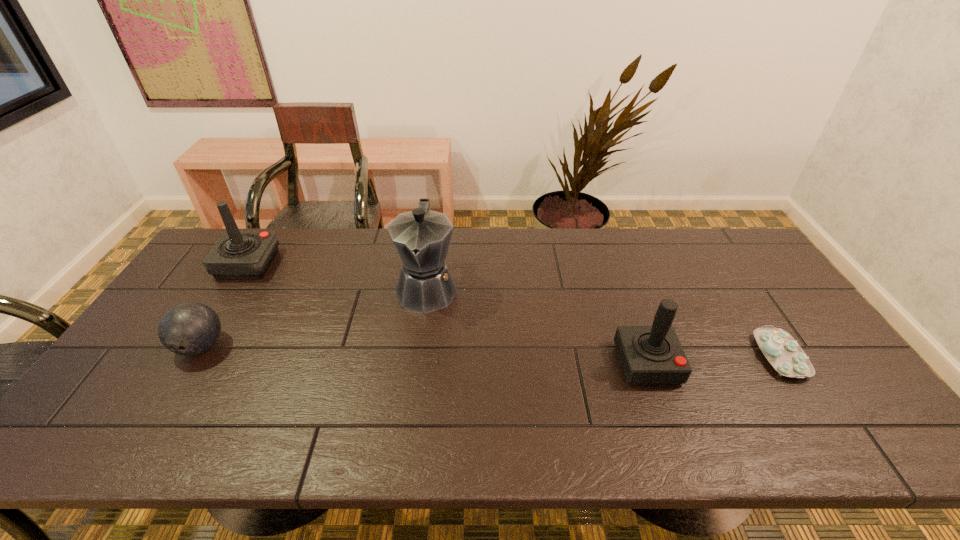
Identify the location of vacant space at the near edge of the desktop. The height and width of the screenshot is (540, 960). (762, 449).

The image size is (960, 540). What are the coordinates of `free spot at the right edge of the desktop` in the screenshot? It's located at (777, 292).

This screenshot has height=540, width=960. Find the location of `free space at the near right corner of the desktop`. free space at the near right corner of the desktop is located at coordinates (838, 454).

The height and width of the screenshot is (540, 960). Find the location of `vacant area that lies between the third object from right to left and the fourth tallest object`. vacant area that lies between the third object from right to left and the fourth tallest object is located at coordinates (314, 318).

At what (x,y) coordinates should I click in order to perform the action: click on unoccupied position between the fourth tallest object and the rightmost object. Please return your answer as a coordinate pair (x, y). Looking at the image, I should click on (491, 351).

The image size is (960, 540). In order to click on vacant area that lies between the farther joystick and the bowling ball in this screenshot , I will do `click(225, 305)`.

Find the location of a particular element. The width and height of the screenshot is (960, 540). empty location between the bowling ball and the right joystick is located at coordinates (424, 355).

I want to click on vacant space in between the bowling ball and the coffeepot, so click(x=314, y=318).

Find the location of `empty space that is in between the shortest object and the left joystick`. empty space that is in between the shortest object and the left joystick is located at coordinates (514, 310).

Where is `vacant area that lies between the shortest object and the bowling ball`? vacant area that lies between the shortest object and the bowling ball is located at coordinates (491, 351).